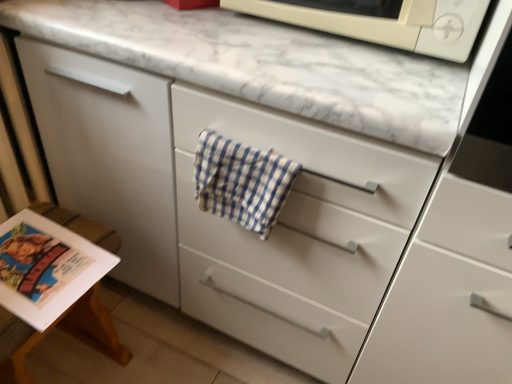
What do you see at coordinates (46, 267) in the screenshot? This screenshot has height=384, width=512. I see `matte paper magazine at lower left` at bounding box center [46, 267].

Describe the element at coordinates (242, 182) in the screenshot. I see `blue checkered towel at center` at that location.

Locate an element on the screen. This screenshot has width=512, height=384. white matte microwave at upper center is located at coordinates (383, 22).

The width and height of the screenshot is (512, 384). What are the coordinates of `matte paper magazine at lower left` in the screenshot? It's located at (46, 267).

Can you tell me how much matte paper magazine at lower left and white matte microwave at upper center differ in facing direction?

The angular difference between matte paper magazine at lower left and white matte microwave at upper center is 87.3 degrees.

Based on the photo, considering their positions, is matte paper magazine at lower left located in front of or behind white matte microwave at upper center?

matte paper magazine at lower left is positioned farther from the viewer than white matte microwave at upper center.

Considering the positions of point (45, 270) and point (460, 35), is point (45, 270) closer or farther from the camera than point (460, 35)?

Point (45, 270) is positioned farther from the camera compared to point (460, 35).

Is there a large distance between matte paper magazine at lower left and white matte microwave at upper center?

No, matte paper magazine at lower left is in close proximity to white matte microwave at upper center.

From the image's perspective, does white matte microwave at upper center appear higher than blue checkered towel at center?

Correct, white matte microwave at upper center appears higher than blue checkered towel at center in the image.

Looking at this image, does white matte microwave at upper center contain blue checkered towel at center?

No.

From a real-world perspective, who is located lower, white matte microwave at upper center or blue checkered towel at center?

blue checkered towel at center.

Considering the points (293, 5) and (9, 258), which point is in front, point (293, 5) or point (9, 258)?

The point (293, 5) is in front.

Is white matte microwave at upper center looking in the opposite direction of matte paper magazine at lower left?

white matte microwave at upper center does not have its back to matte paper magazine at lower left.

Is there a large distance between white matte microwave at upper center and matte paper magazine at lower left?

white matte microwave at upper center is near matte paper magazine at lower left, not far away.

Is white matte microwave at upper center in front of matte paper magazine at lower left?

Yes, the depth of white matte microwave at upper center is less than that of matte paper magazine at lower left.

Based on the photo, choose the correct answer: Is matte paper magazine at lower left inside blue checkered towel at center or outside it?

matte paper magazine at lower left exists outside the volume of blue checkered towel at center.

From the image's perspective, which one is positioned higher, matte paper magazine at lower left or blue checkered towel at center?

blue checkered towel at center appears higher in the image.

Can you confirm if matte paper magazine at lower left is bigger than blue checkered towel at center?

Yes, matte paper magazine at lower left is bigger than blue checkered towel at center.

Considering the relative sizes of matte paper magazine at lower left and blue checkered towel at center in the image provided, is matte paper magazine at lower left wider than blue checkered towel at center?

Indeed, matte paper magazine at lower left has a greater width compared to blue checkered towel at center.

From a real-world perspective, which is physically above, blue checkered towel at center or white matte microwave at upper center?

white matte microwave at upper center.

Which is behind, point (279, 159) or point (457, 14)?

Point (279, 159)

You are a GUI agent. You are given a task and a screenshot of the screen. Output one action in this format:
    pyautogui.click(x=<x>, y=<y>)
    Task: Click on the beach towel behind the white matte microwave at upper center
    
    Given the screenshot: What is the action you would take?
    pyautogui.click(x=242, y=182)

Is blue checkered towel at center not within white matte microwave at upper center?

Absolutely, blue checkered towel at center is external to white matte microwave at upper center.

Which object is wider, blue checkered towel at center or matte paper magazine at lower left?

Wider between the two is matte paper magazine at lower left.

This screenshot has height=384, width=512. I want to click on beach towel in front of the matte paper magazine at lower left, so click(242, 182).

Which is behind, blue checkered towel at center or matte paper magazine at lower left?

Positioned behind is matte paper magazine at lower left.

From the picture: Who is taller, blue checkered towel at center or matte paper magazine at lower left?

Standing taller between the two is matte paper magazine at lower left.

The height and width of the screenshot is (384, 512). Identify the location of magazine that appears behind the white matte microwave at upper center. (46, 267).

Where is `microwave oven that is above the blue checkered towel at center (from the image's perspective)`? This screenshot has width=512, height=384. microwave oven that is above the blue checkered towel at center (from the image's perspective) is located at coordinates (383, 22).

Considering their positions, is white matte microwave at upper center positioned further to blue checkered towel at center than matte paper magazine at lower left?

The object further to blue checkered towel at center is matte paper magazine at lower left.

Looking at the image, which one is located further to white matte microwave at upper center, blue checkered towel at center or matte paper magazine at lower left?

Among the two, matte paper magazine at lower left is located further to white matte microwave at upper center.

Estimate the real-world distances between objects in this image. Which object is further from matte paper magazine at lower left, white matte microwave at upper center or blue checkered towel at center?

white matte microwave at upper center lies further to matte paper magazine at lower left than the other object.

When comparing their distances from blue checkered towel at center, does matte paper magazine at lower left or white matte microwave at upper center seem closer?

The object closer to blue checkered towel at center is white matte microwave at upper center.

From the image, which object appears to be nearer to matte paper magazine at lower left, blue checkered towel at center or white matte microwave at upper center?

The object closer to matte paper magazine at lower left is blue checkered towel at center.

From the image, which object appears to be nearer to white matte microwave at upper center, matte paper magazine at lower left or blue checkered towel at center?

Among the two, blue checkered towel at center is located nearer to white matte microwave at upper center.

This screenshot has height=384, width=512. What are the coordinates of `beach towel between white matte microwave at upper center and matte paper magazine at lower left in the up-down direction` in the screenshot? It's located at (242, 182).